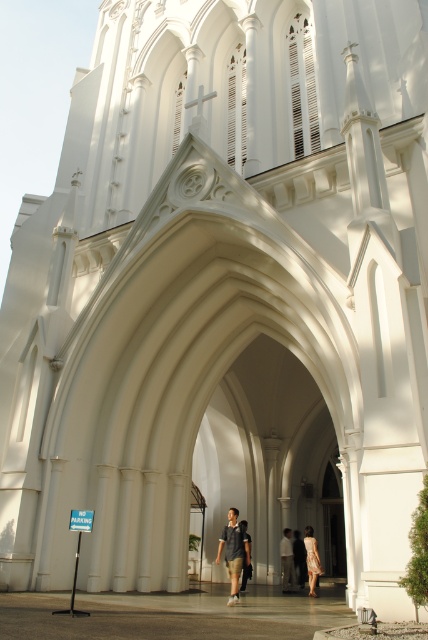
Is floral dress at center shorter than dark blue shirt at center?

Indeed, floral dress at center has a lesser height compared to dark blue shirt at center.

Based on the photo, is floral dress at center thinner than dark blue shirt at center?

No, floral dress at center is not thinner than dark blue shirt at center.

Looking at this image, who is more distant from viewer, (306, 538) or (249, 540)?

Positioned behind is point (306, 538).

This screenshot has width=428, height=640. I want to click on floral dress at center, so click(x=312, y=560).

Can you confirm if dark gray fabric shirt at center is thinner than light beige dress at center?

Incorrect, dark gray fabric shirt at center's width is not less than light beige dress at center's.

Describe the element at coordinates (234, 550) in the screenshot. Image resolution: width=428 pixels, height=640 pixels. I see `dark gray fabric shirt at center` at that location.

Which is behind, point (237, 593) or point (300, 556)?

Point (300, 556)

You are a GUI agent. You are given a task and a screenshot of the screen. Output one action in this format:
    pyautogui.click(x=<x>, y=<y>)
    Task: Click on the dark gray fabric shirt at center
    
    Given the screenshot: What is the action you would take?
    pyautogui.click(x=234, y=550)

Between light beige dress at center and dark blue shirt at center, which one is positioned lower?

light beige dress at center is below.

In order to click on light beige dress at center in this screenshot , I will do `click(300, 557)`.

Does point (299, 531) come closer to viewer compared to point (241, 589)?

No, (299, 531) is further to viewer.

The width and height of the screenshot is (428, 640). Identify the location of light beige dress at center. (300, 557).